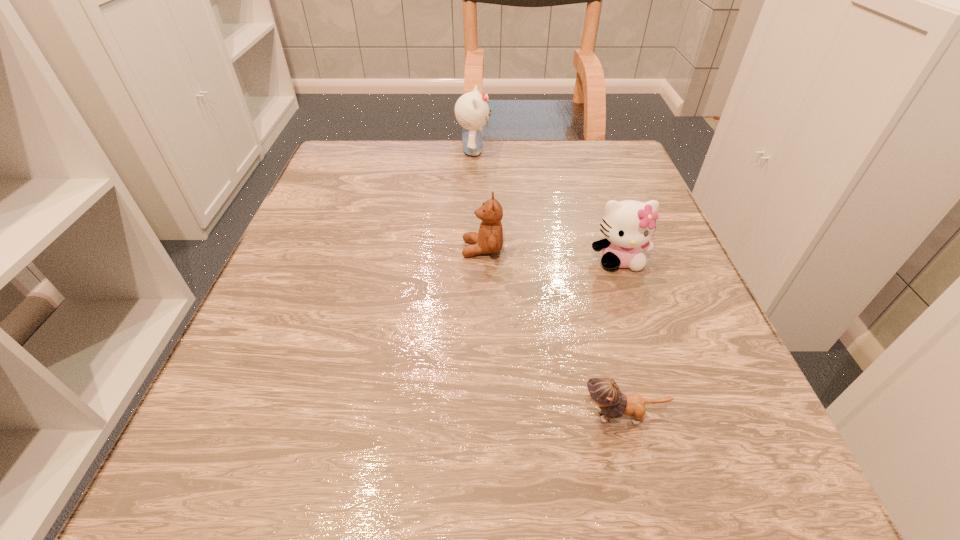
Identify the location of free area in between the second tallest kitten and the nearest kitten. (620, 338).

Where is `object identified as the third closest to the teddy bear`? The height and width of the screenshot is (540, 960). object identified as the third closest to the teddy bear is located at coordinates (605, 393).

Choose which object is the second nearest neighbor to the second shortest kitten. Please provide its 2D coordinates. Your answer should be formatted as a tuple, i.e. [(x, y)], where the tuple contains the x and y coordinates of a point satisfying the conditions above.

[(605, 393)]

I want to click on kitten identified as the second closest to the shortest object, so click(x=472, y=112).

Choose which kitten is the second nearest neighbor to the second shortest kitten. Please provide its 2D coordinates. Your answer should be formatted as a tuple, i.e. [(x, y)], where the tuple contains the x and y coordinates of a point satisfying the conditions above.

[(472, 112)]

I want to click on vacant area in the image that satisfies the following two spatial constraints: 1. on the front-facing side of the second tallest kitten; 2. on the front-facing side of the nearest object, so click(x=672, y=416).